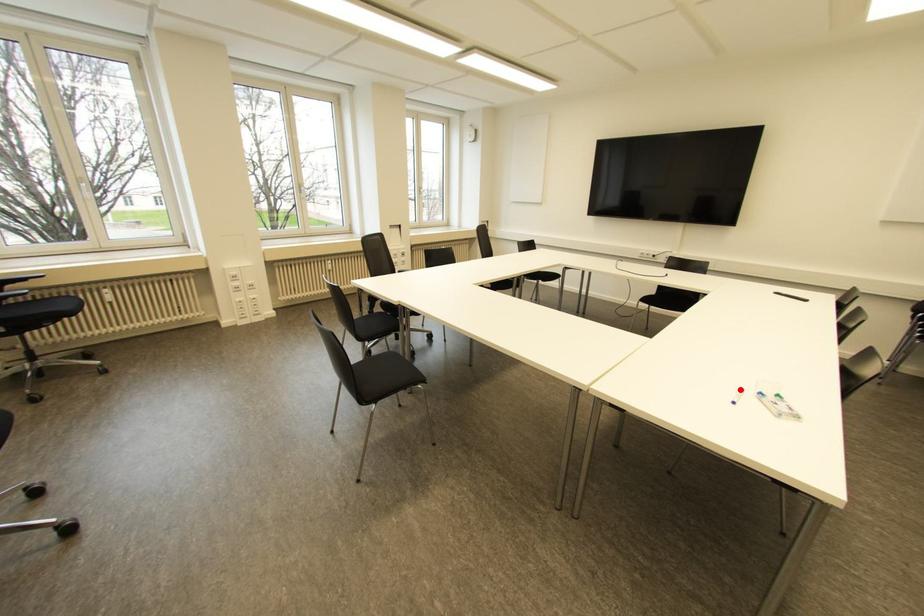
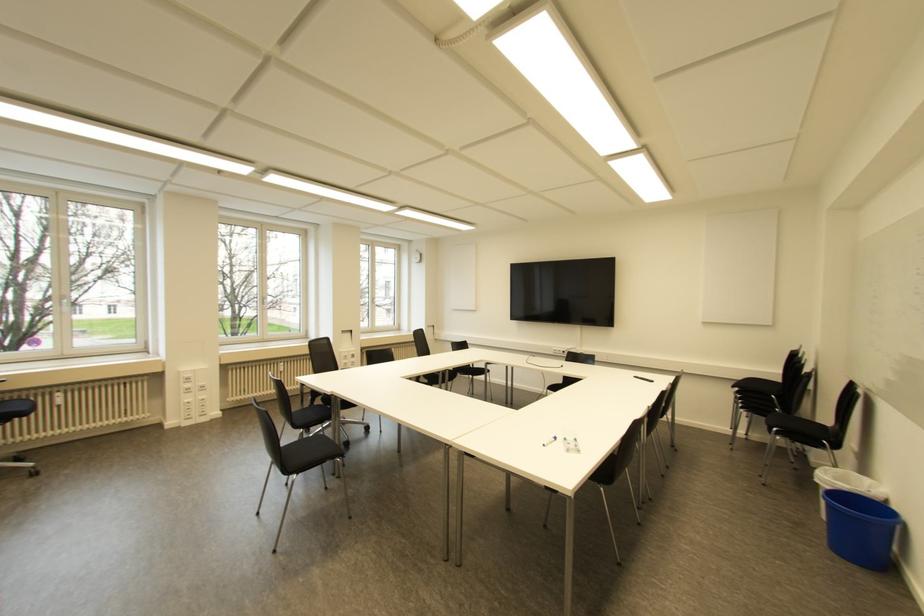
Find the pixel in the second image that matches the highlighted location in the first image.

(554, 438)